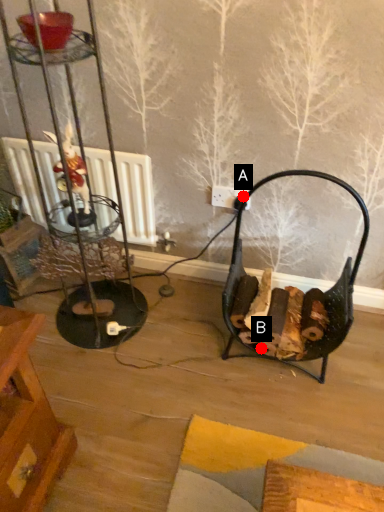
Question: Two points are circled on the image, labeled by A and B beside each circle. Which point is closer to the camera?

Choices:
 (A) A is closer
 (B) B is closer

Answer: (B)